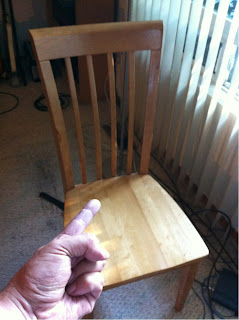
Locate an element on the screen. chair leg is located at coordinates (187, 289), (89, 316).